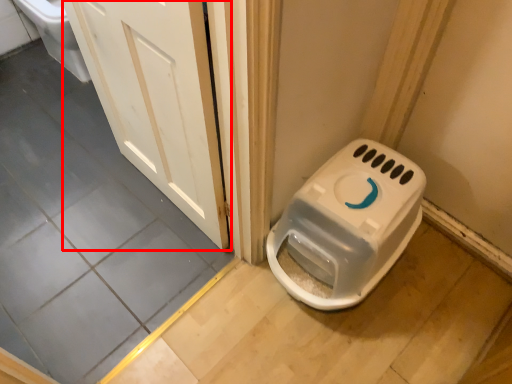
Question: Observing the image, what is the correct spatial positioning of door (annotated by the red box) in reference to toilet?

Choices:
 (A) left
 (B) right

Answer: (A)